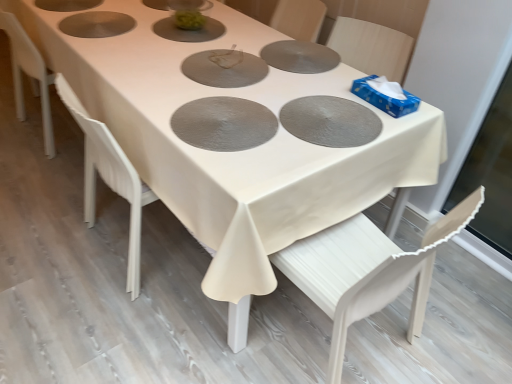
At what (x,y) coordinates should I click in order to perform the action: click on free location in front of matte gray pizza pan at center, which is the second pizza pan in bottom-to-top order. Please return your answer as a coordinate pair (x, y). This screenshot has height=384, width=512. Looking at the image, I should click on (290, 157).